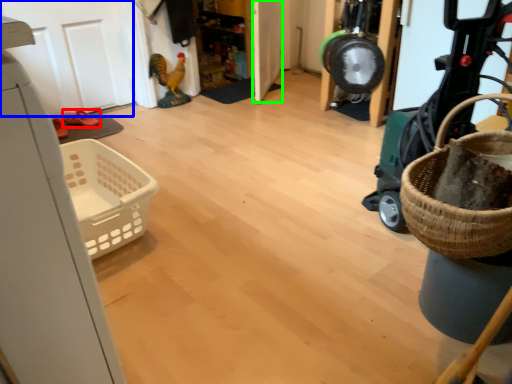
Question: Based on their relative distances, which object is farther from footwear (highlighted by a red box)? Choose from door (highlighted by a blue box) and door (highlighted by a green box).

Choices:
 (A) door
 (B) door

Answer: (B)